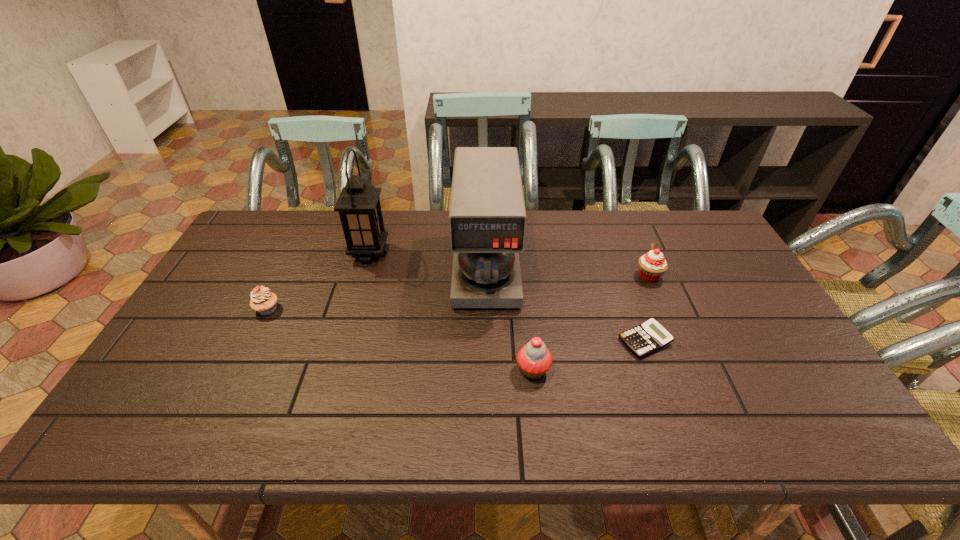
Image resolution: width=960 pixels, height=540 pixels. In order to click on free space located on the right of the second cupcake from left to right in this screenshot , I will do `click(703, 370)`.

Image resolution: width=960 pixels, height=540 pixels. I want to click on free space located on the left of the leftmost cupcake, so click(x=202, y=309).

The height and width of the screenshot is (540, 960). I want to click on vacant space positioned on the back of the shortest object, so click(621, 275).

Locate an element on the screen. This screenshot has width=960, height=540. lantern that is positioned at the far edge is located at coordinates (359, 208).

The image size is (960, 540). Find the location of `coffee maker present at the far edge`. coffee maker present at the far edge is located at coordinates (487, 216).

At what (x,y) coordinates should I click in order to perform the action: click on vacant space at the far edge of the desktop. Please return your answer as a coordinate pair (x, y). The image size is (960, 540). Looking at the image, I should click on (600, 213).

Where is `vacant space at the near edge`? The width and height of the screenshot is (960, 540). vacant space at the near edge is located at coordinates (252, 428).

What are the coordinates of `free space at the left edge` in the screenshot? It's located at (180, 338).

At what (x,y) coordinates should I click in order to perform the action: click on vacant space at the right edge of the desktop. Please return your answer as a coordinate pair (x, y). This screenshot has width=960, height=540. Looking at the image, I should click on (732, 281).

The height and width of the screenshot is (540, 960). Identify the location of vacant region at the far left corner of the desktop. (238, 246).